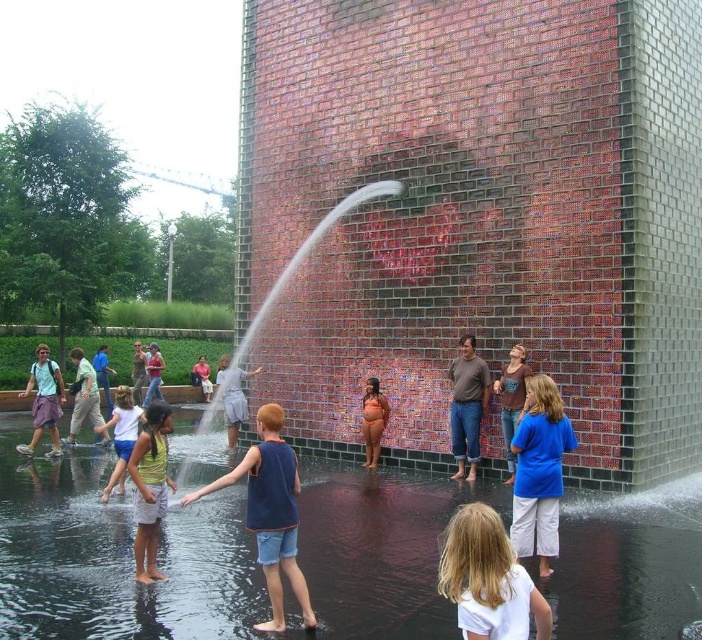
Who is positioned more to the right, white cotton shirt at lower center or blue denim shorts at lower left?

Positioned to the right is white cotton shirt at lower center.

Between white cotton shirt at lower center and blue denim shorts at lower left, which one appears on the left side from the viewer's perspective?

blue denim shorts at lower left is more to the left.

Who is more distant from viewer, (538, 624) or (131, 422)?

The point (131, 422) is more distant.

Identify the location of white cotton shirt at lower center. This screenshot has width=702, height=640. pos(489,579).

Locate an element on the screen. This screenshot has width=702, height=640. brown leather jacket at center is located at coordinates (510, 400).

Can you confirm if brown leather jacket at center is positioned below matte white shirt at center?

No.

Which is in front, point (515, 358) or point (227, 397)?

Point (515, 358) is in front.

The image size is (702, 640). I want to click on brown leather jacket at center, so click(x=510, y=400).

Does point (510, 628) lie behind point (213, 486)?

No, (510, 628) is in front of (213, 486).

Does point (449, 524) come closer to viewer compared to point (279, 621)?

That is False.

Where is `white cotton shirt at lower center`? Image resolution: width=702 pixels, height=640 pixels. white cotton shirt at lower center is located at coordinates (489, 579).